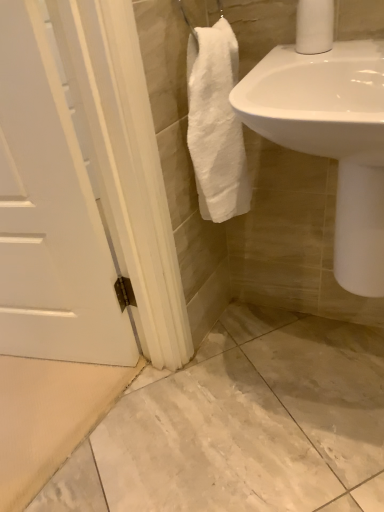
Measure the distance between point (378, 82) and camera.

A distance of 32.48 inches exists between point (378, 82) and camera.

This screenshot has height=512, width=384. What do you see at coordinates (331, 139) in the screenshot? I see `white glossy sink at upper right` at bounding box center [331, 139].

Identify the location of white glossy sink at upper right. This screenshot has width=384, height=512. (331, 139).

This screenshot has width=384, height=512. What do you see at coordinates (314, 26) in the screenshot? I see `white matte toilet paper at upper right` at bounding box center [314, 26].

Identify the location of white matte toilet paper at upper right. [314, 26].

Locate an element on the screen. white glossy sink at upper right is located at coordinates (331, 139).

Looking at this image, between white matte toilet paper at upper right and white glossy sink at upper right, which one appears on the right side from the viewer's perspective?

white glossy sink at upper right is more to the right.

Is the position of white matte toilet paper at upper right more distant than that of white glossy sink at upper right?

Yes, white matte toilet paper at upper right is further from the viewer.

Does point (318, 4) come closer to viewer compared to point (340, 181)?

That is True.

From the image's perspective, is white matte toilet paper at upper right located above white glossy sink at upper right?

Yes, from the image's perspective, white matte toilet paper at upper right is above white glossy sink at upper right.

From a real-world perspective, does white matte toilet paper at upper right sit lower than white glossy sink at upper right?

No, from a real-world perspective, white matte toilet paper at upper right is not below white glossy sink at upper right.

From the picture: In terms of width, does white matte toilet paper at upper right look wider or thinner when compared to white glossy sink at upper right?

Clearly, white matte toilet paper at upper right has less width compared to white glossy sink at upper right.

Is white matte toilet paper at upper right taller than white glossy sink at upper right?

No, white matte toilet paper at upper right is not taller than white glossy sink at upper right.

Does white matte toilet paper at upper right have a smaller size compared to white glossy sink at upper right?

Correct, white matte toilet paper at upper right occupies less space than white glossy sink at upper right.

Would you say white matte toilet paper at upper right is inside or outside white glossy sink at upper right?

white matte toilet paper at upper right exists outside the volume of white glossy sink at upper right.

Are white matte toilet paper at upper right and white glossy sink at upper right making contact?

No, white matte toilet paper at upper right is not beside white glossy sink at upper right.

Could you tell me if white matte toilet paper at upper right is turned towards white glossy sink at upper right?

No, white matte toilet paper at upper right is not oriented towards white glossy sink at upper right.

How different are the orientations of white matte toilet paper at upper right and white glossy sink at upper right in degrees?

white matte toilet paper at upper right and white glossy sink at upper right are facing 0.00109 degrees away from each other.

Measure the distance from white matte toilet paper at upper right to white glossy sink at upper right.

white matte toilet paper at upper right and white glossy sink at upper right are 8.99 inches apart.

Where is `toilet paper that appears on the left of white glossy sink at upper right`? Image resolution: width=384 pixels, height=512 pixels. toilet paper that appears on the left of white glossy sink at upper right is located at coordinates (314, 26).

Which is more to the left, white glossy sink at upper right or white matte toilet paper at upper right?

white matte toilet paper at upper right is more to the left.

Which is in front, white glossy sink at upper right or white matte toilet paper at upper right?

Positioned in front is white glossy sink at upper right.

Between point (250, 106) and point (301, 34), which one is positioned in front?

Point (250, 106)

From the image's perspective, is white glossy sink at upper right on white matte toilet paper at upper right?

Actually, white glossy sink at upper right appears below white matte toilet paper at upper right in the image.

From a real-world perspective, is white glossy sink at upper right on white matte toilet paper at upper right?

No, from a real-world perspective, white glossy sink at upper right is not over white matte toilet paper at upper right

Considering the sizes of objects white glossy sink at upper right and white matte toilet paper at upper right in the image provided, who is thinner, white glossy sink at upper right or white matte toilet paper at upper right?

With smaller width is white matte toilet paper at upper right.

Considering the sizes of white glossy sink at upper right and white matte toilet paper at upper right in the image, is white glossy sink at upper right taller or shorter than white matte toilet paper at upper right?

white glossy sink at upper right is taller than white matte toilet paper at upper right.

Does white glossy sink at upper right have a smaller size compared to white matte toilet paper at upper right?

No, white glossy sink at upper right is not smaller than white matte toilet paper at upper right.

Would you say white glossy sink at upper right is outside white matte toilet paper at upper right?

Yes, white glossy sink at upper right is outside of white matte toilet paper at upper right.

Is white glossy sink at upper right next to white matte toilet paper at upper right?

No, white glossy sink at upper right is not touching white matte toilet paper at upper right.

Looking at this image, could you tell me if white glossy sink at upper right is turned towards white matte toilet paper at upper right?

No, white glossy sink at upper right is not turned towards white matte toilet paper at upper right.

How distant is white glossy sink at upper right from white matte toilet paper at upper right?

They are 8.99 inches apart.

Where is `toilet paper above the white glossy sink at upper right (from a real-world perspective)`? This screenshot has width=384, height=512. toilet paper above the white glossy sink at upper right (from a real-world perspective) is located at coordinates (314, 26).

This screenshot has height=512, width=384. I want to click on toilet paper positioned vertically above the white glossy sink at upper right (from a real-world perspective), so click(x=314, y=26).

Locate an element on the screen. sink in front of the white matte toilet paper at upper right is located at coordinates (331, 139).